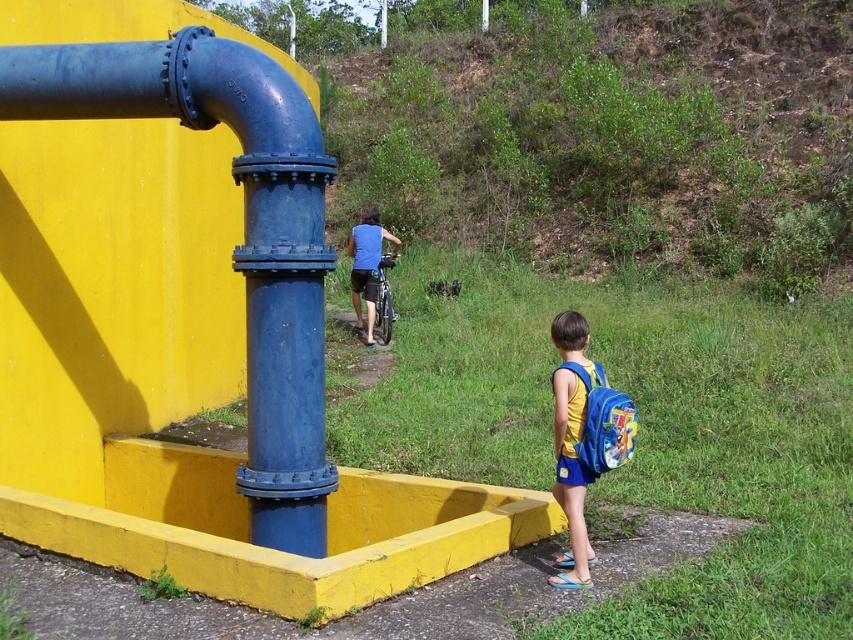
Question: Can you confirm if blue fabric backpack at center is positioned below blue matte shirt at center?

Choices:
 (A) no
 (B) yes

Answer: (B)

Question: Is blue fabric backpack at center closer to the viewer compared to blue matte shirt at center?

Choices:
 (A) no
 (B) yes

Answer: (B)

Question: Among these objects, which one is farthest from the camera?

Choices:
 (A) blue fabric backpack at center
 (B) blue metallic pipe at left

Answer: (B)

Question: Can you confirm if blue metallic pipe at left is positioned to the right of blue matte shirt at center?

Choices:
 (A) yes
 (B) no

Answer: (B)

Question: Estimate the real-world distances between objects in this image. Which object is closer to the blue matte shirt at center?

Choices:
 (A) blue metallic pipe at left
 (B) blue fabric backpack at center

Answer: (A)

Question: Which point is closer to the camera?

Choices:
 (A) blue fabric backpack at center
 (B) blue metallic pipe at left
 (C) blue matte shirt at center

Answer: (A)